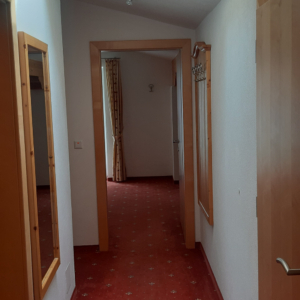
Identify the location of wall. (235, 207), (87, 188), (64, 190), (148, 119).